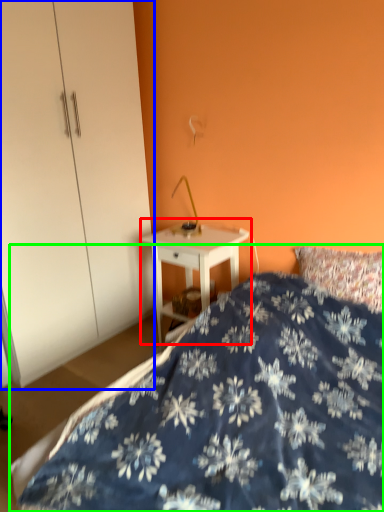
Question: Which object is the closest to the nightstand (highlighted by a red box)? Choose among these: dresser (highlighted by a blue box) or bed (highlighted by a green box).

Choices:
 (A) dresser
 (B) bed

Answer: (A)